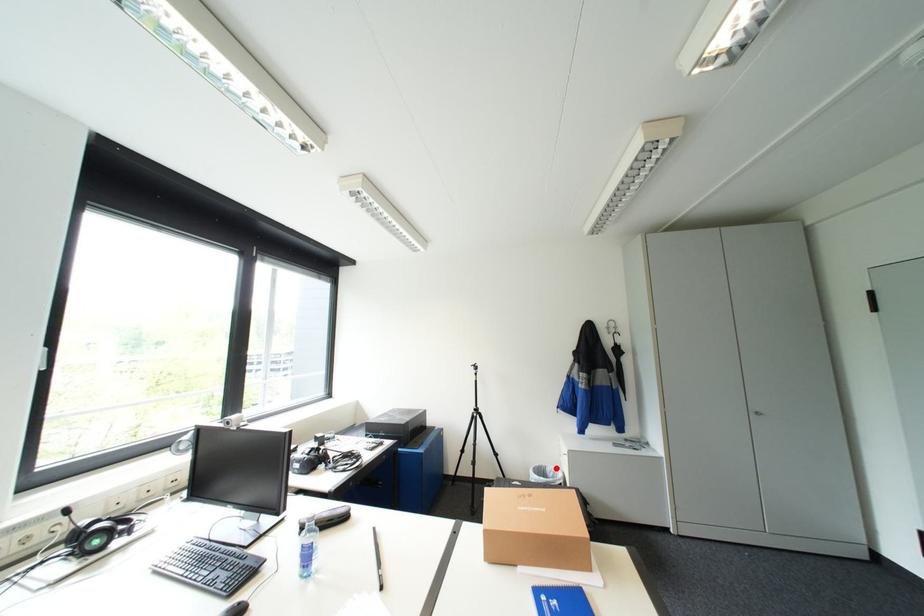
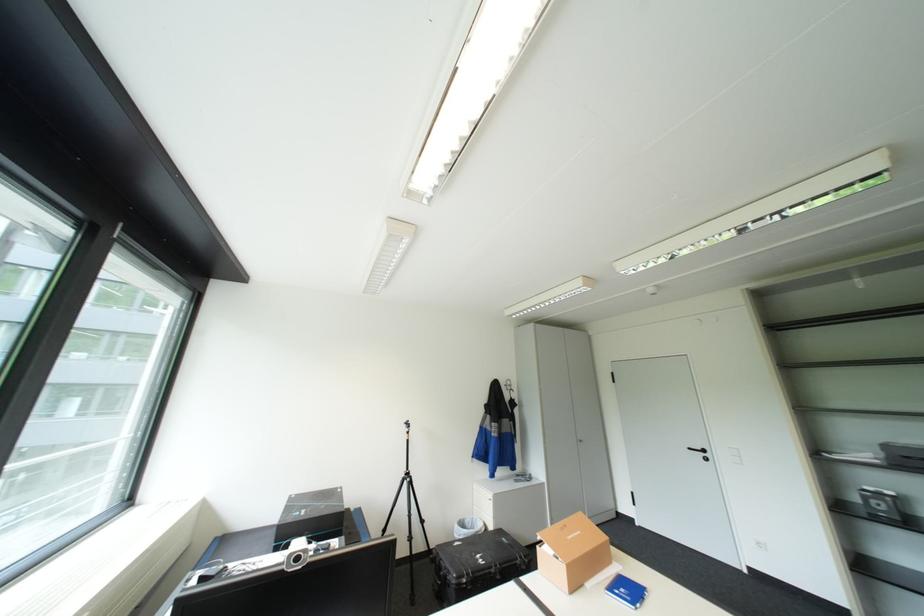
In the second image, find the point that corresponds to the highlighted location in the first image.

(475, 521)